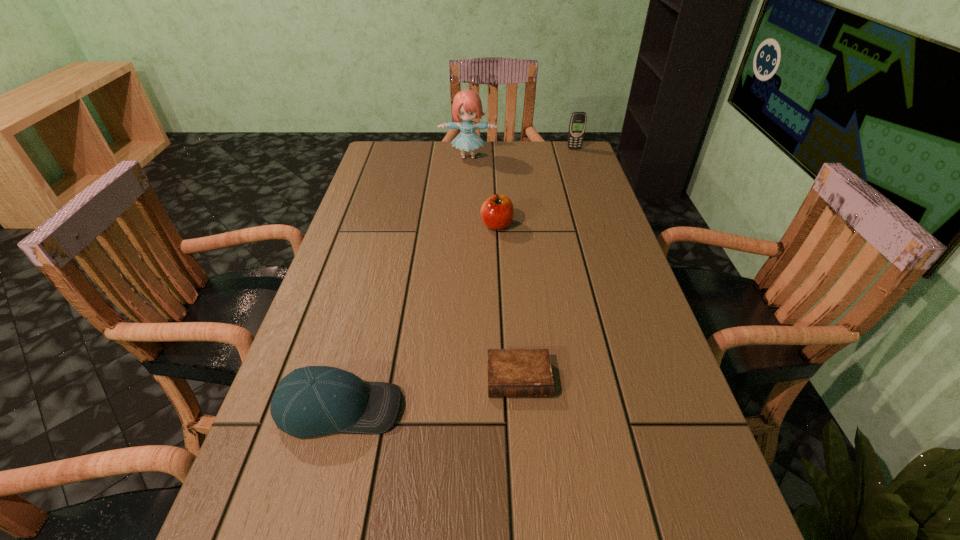
Find the location of `the tallest object`. the tallest object is located at coordinates (467, 105).

Identify the location of the second farthest object. The height and width of the screenshot is (540, 960). (467, 105).

Identify the location of the second tallest object. (577, 126).

The width and height of the screenshot is (960, 540). Find the location of `the rightmost object`. the rightmost object is located at coordinates (577, 126).

The width and height of the screenshot is (960, 540). Find the location of `the third nearest object`. the third nearest object is located at coordinates (497, 212).

This screenshot has height=540, width=960. I want to click on baseball cap, so click(x=311, y=401).

Locate an element on the screen. The height and width of the screenshot is (540, 960). the shortest object is located at coordinates (511, 372).

The width and height of the screenshot is (960, 540). I want to click on vacant space situated 0.340m on the front-facing side of the second farthest object, so click(466, 221).

Find the location of a particular element. The height and width of the screenshot is (540, 960). vacant space situated 0.270m on the screen of the farthest object is located at coordinates pyautogui.click(x=588, y=188).

The height and width of the screenshot is (540, 960). Identify the location of vacant area located on the front of the third farthest object. (501, 308).